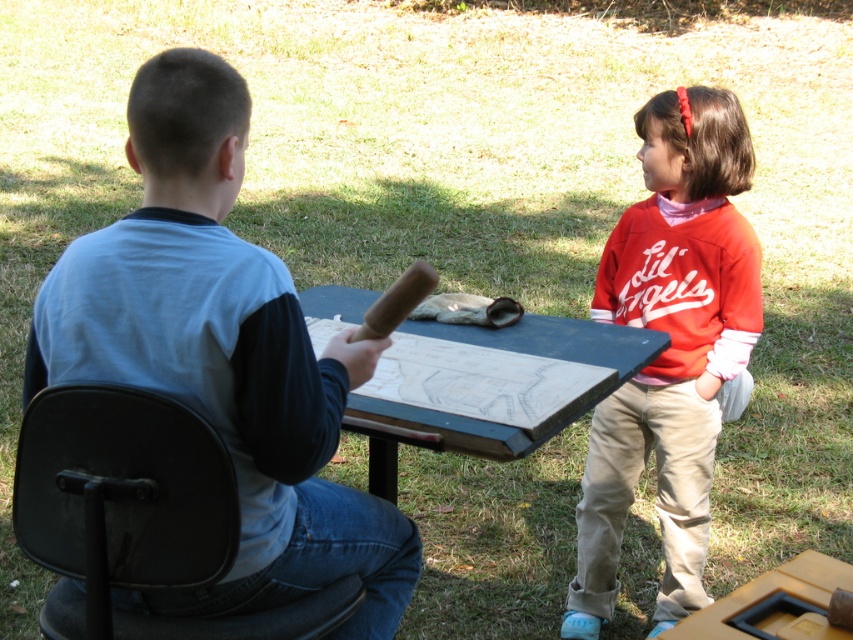
Measure the distance from wooden picnic table at center to brown wooden baseball bat at center.

1.70 meters

Is wooden picnic table at center taller than brown wooden baseball bat at center?

Indeed, wooden picnic table at center has a greater height compared to brown wooden baseball bat at center.

At what (x,y) coordinates should I click in order to perform the action: click on wooden picnic table at center. Please return your answer as a coordinate pair (x, y). The height and width of the screenshot is (640, 853). Looking at the image, I should click on 491,481.

The height and width of the screenshot is (640, 853). In order to click on wooden picnic table at center in this screenshot , I will do `click(491, 481)`.

Can you confirm if light blue cotton shirt at center is positioned below wooden picnic table at center?

Actually, light blue cotton shirt at center is above wooden picnic table at center.

Who is higher up, light blue cotton shirt at center or wooden picnic table at center?

light blue cotton shirt at center is higher up.

What do you see at coordinates (223, 355) in the screenshot? The width and height of the screenshot is (853, 640). I see `light blue cotton shirt at center` at bounding box center [223, 355].

Locate an element on the screen. The image size is (853, 640). light blue cotton shirt at center is located at coordinates (223, 355).

Who is more forward, (387, 572) or (109, 532)?

Point (109, 532) is in front.

Does point (67, 246) lie in front of point (161, 419)?

No, (67, 246) is behind (161, 419).

The height and width of the screenshot is (640, 853). Identify the location of light blue cotton shirt at center. (223, 355).